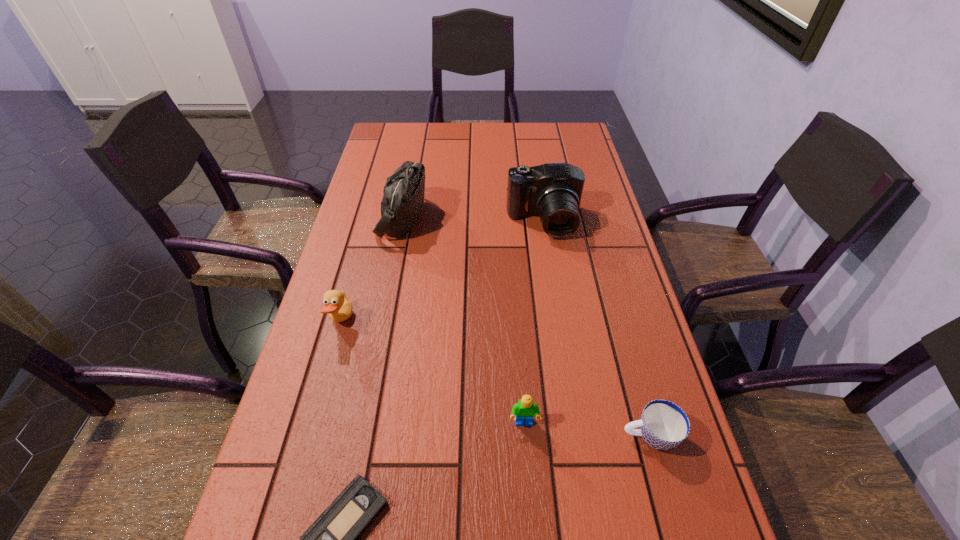
Where is `blank region between the Lego and the fifth tallest object`? The width and height of the screenshot is (960, 540). blank region between the Lego and the fifth tallest object is located at coordinates (587, 430).

Image resolution: width=960 pixels, height=540 pixels. Identify the location of empty space that is in between the fifth shortest object and the Lego. (534, 322).

Where is `free space between the camera and the fourth nearest object`? This screenshot has width=960, height=540. free space between the camera and the fourth nearest object is located at coordinates (443, 272).

Identify which object is the fifth closest to the shoulder bag. Please provide its 2D coordinates. Your answer should be formatted as a tuple, i.e. [(x, y)], where the tuple contains the x and y coordinates of a point satisfying the conditions above.

[(663, 425)]

Where is `object that stands as the fifth closest to the second shortest object`? This screenshot has width=960, height=540. object that stands as the fifth closest to the second shortest object is located at coordinates (403, 199).